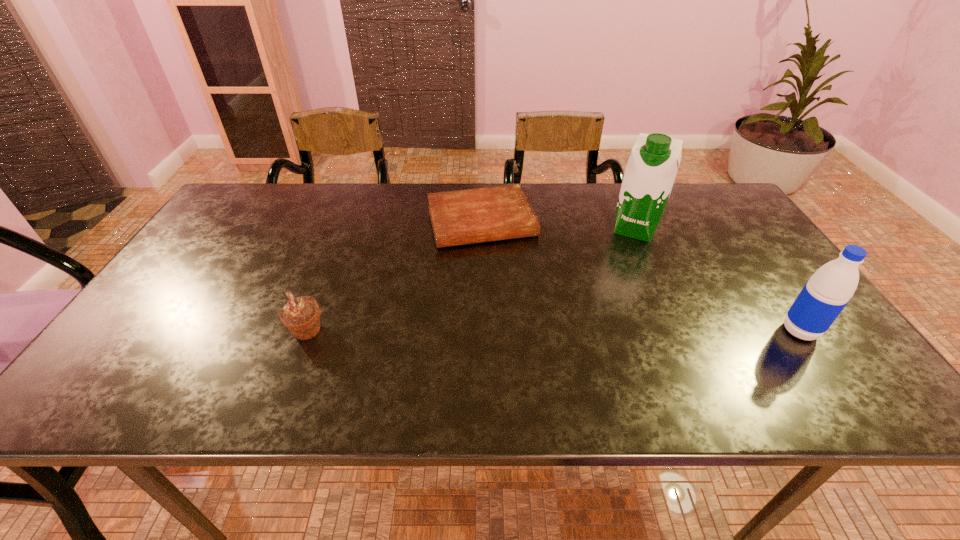
The image size is (960, 540). I want to click on object located in the right edge section of the desktop, so click(825, 295).

Where is `object that is at the near right corner`? object that is at the near right corner is located at coordinates (825, 295).

The width and height of the screenshot is (960, 540). I want to click on vacant space at the far edge, so click(672, 193).

Where is `vacant area at the near edge of the desktop`? vacant area at the near edge of the desktop is located at coordinates (541, 340).

In the image, there is a desktop. Where is `vacant space at the left edge`? The width and height of the screenshot is (960, 540). vacant space at the left edge is located at coordinates (217, 251).

At what (x,y) coordinates should I click in order to perform the action: click on vacant area at the right edge. Please return your answer as a coordinate pair (x, y). This screenshot has width=960, height=540. Looking at the image, I should click on (784, 334).

Identify the location of free region at the far left corner. (247, 213).

In order to click on free space at the far right corner in this screenshot , I will do `click(715, 207)`.

You are a GUI agent. You are given a task and a screenshot of the screen. Output one action in this format:
    pyautogui.click(x=<x>, y=<y>)
    Task: Click on the vacant space at the near right corner of the desktop
    This screenshot has height=540, width=960.
    Given the screenshot: What is the action you would take?
    pyautogui.click(x=780, y=362)

Locate an element on the screen. vacant area between the third shortest object and the soya milk is located at coordinates (717, 280).